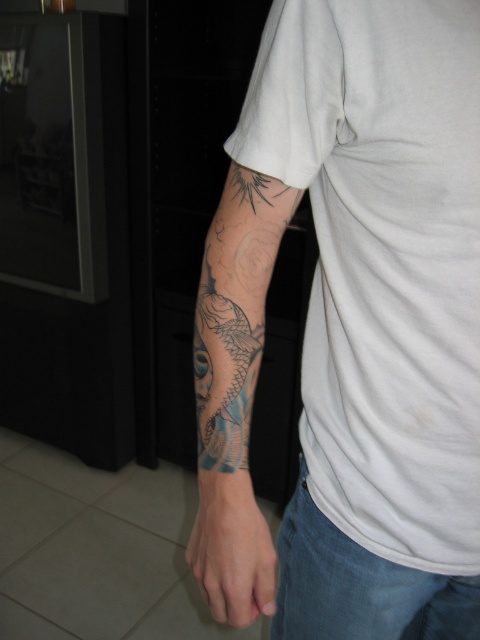
Question: Does white cotton t-shirt at upper right have a greater width compared to black ink tattoo at lower left?

Choices:
 (A) yes
 (B) no

Answer: (A)

Question: Can you confirm if white cotton t-shirt at upper right is bigger than black ink tattoo at lower left?

Choices:
 (A) no
 (B) yes

Answer: (B)

Question: Is white cotton t-shirt at upper right closer to camera compared to black ink tattoo at lower left?

Choices:
 (A) yes
 (B) no

Answer: (A)

Question: Estimate the real-world distances between objects in this image. Which object is farther from the smooth skin at lower left?

Choices:
 (A) white cotton t-shirt at upper right
 (B) black ink tattoo at lower left

Answer: (A)

Question: Which of these objects is positioned closest to the smooth skin at lower left?

Choices:
 (A) white cotton t-shirt at upper right
 (B) black ink tattoo at lower left

Answer: (B)

Question: Based on their relative distances, which object is farther from the white cotton t-shirt at upper right?

Choices:
 (A) black ink tattoo at lower left
 (B) smooth skin at lower left

Answer: (B)